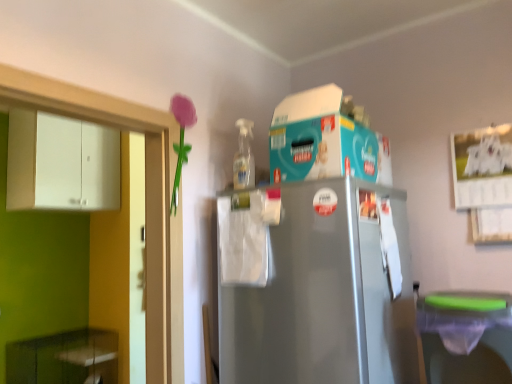
Question: Is white matte cabinet at left, the first cabinetry in the top-to-bottom sequence, next to matte plastic flower at upper left?

Choices:
 (A) yes
 (B) no

Answer: (B)

Question: Can you confirm if white matte cabinet at left, the first cabinetry in the top-to-bottom sequence, is positioned to the left of matte plastic flower at upper left?

Choices:
 (A) no
 (B) yes

Answer: (B)

Question: Can you confirm if white matte cabinet at left, which is the 2th cabinetry from bottom to top, is smaller than matte plastic flower at upper left?

Choices:
 (A) yes
 (B) no

Answer: (B)

Question: Considering the relative positions of white matte cabinet at left, the first cabinetry in the top-to-bottom sequence, and matte plastic flower at upper left in the image provided, is white matte cabinet at left, the first cabinetry in the top-to-bottom sequence, behind matte plastic flower at upper left?

Choices:
 (A) yes
 (B) no

Answer: (A)

Question: Considering the relative sizes of white matte cabinet at left, the first cabinetry in the top-to-bottom sequence, and matte plastic flower at upper left in the image provided, is white matte cabinet at left, the first cabinetry in the top-to-bottom sequence, bigger than matte plastic flower at upper left?

Choices:
 (A) yes
 (B) no

Answer: (A)

Question: Is green glossy cabinet at lower left, marked as the first cabinetry in a bottom-to-top arrangement, taller or shorter than green plastic dish washer at lower right?

Choices:
 (A) short
 (B) tall

Answer: (B)

Question: Is point (71, 339) positioned closer to the camera than point (471, 339)?

Choices:
 (A) closer
 (B) farther

Answer: (B)

Question: From the image's perspective, relative to green plastic dish washer at lower right, is green glossy cabinet at lower left, marked as the first cabinetry in a bottom-to-top arrangement, above or below?

Choices:
 (A) above
 (B) below

Answer: (B)

Question: Would you say green glossy cabinet at lower left, marked as the first cabinetry in a bottom-to-top arrangement, is inside or outside green plastic dish washer at lower right?

Choices:
 (A) inside
 (B) outside

Answer: (B)

Question: In the image, is teal cardboard box at upper center on the left side or the right side of green plastic dish washer at lower right?

Choices:
 (A) right
 (B) left

Answer: (B)

Question: From a real-world perspective, relative to green plastic dish washer at lower right, is teal cardboard box at upper center vertically above or below?

Choices:
 (A) below
 (B) above

Answer: (B)

Question: Is point (382, 140) positioned closer to the camera than point (433, 301)?

Choices:
 (A) closer
 (B) farther

Answer: (B)

Question: In terms of width, does teal cardboard box at upper center look wider or thinner when compared to green plastic dish washer at lower right?

Choices:
 (A) wide
 (B) thin

Answer: (A)

Question: From a real-world perspective, is matte plastic flower at upper left physically located above or below white matte cabinet at left, the first cabinetry in the top-to-bottom sequence?

Choices:
 (A) above
 (B) below

Answer: (B)

Question: Which is correct: matte plastic flower at upper left is inside white matte cabinet at left, the first cabinetry in the top-to-bottom sequence, or outside of it?

Choices:
 (A) inside
 (B) outside

Answer: (B)